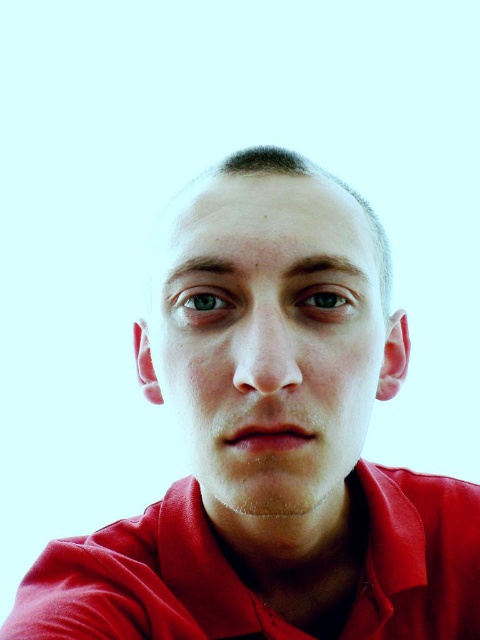
Question: Among these points, which one is farthest from the camera?

Choices:
 (A) (231, 301)
 (B) (475, 630)
 (C) (226, 412)

Answer: (B)

Question: Does matte red polo shirt at center appear on the left side of matte brown eye at center?

Choices:
 (A) no
 (B) yes

Answer: (B)

Question: Which object is the farthest from the matte red polo shirt at center?

Choices:
 (A) matte brown eye at center
 (B) green matte eye at center
 (C) matte red face at center

Answer: (A)

Question: Where is matte red polo shirt at center located in relation to green matte eye at center in the image?

Choices:
 (A) below
 (B) above

Answer: (A)

Question: Does matte red polo shirt at center have a greater width compared to green matte eye at center?

Choices:
 (A) yes
 (B) no

Answer: (A)

Question: Among these objects, which one is farthest from the camera?

Choices:
 (A) matte red face at center
 (B) matte brown eye at center

Answer: (B)